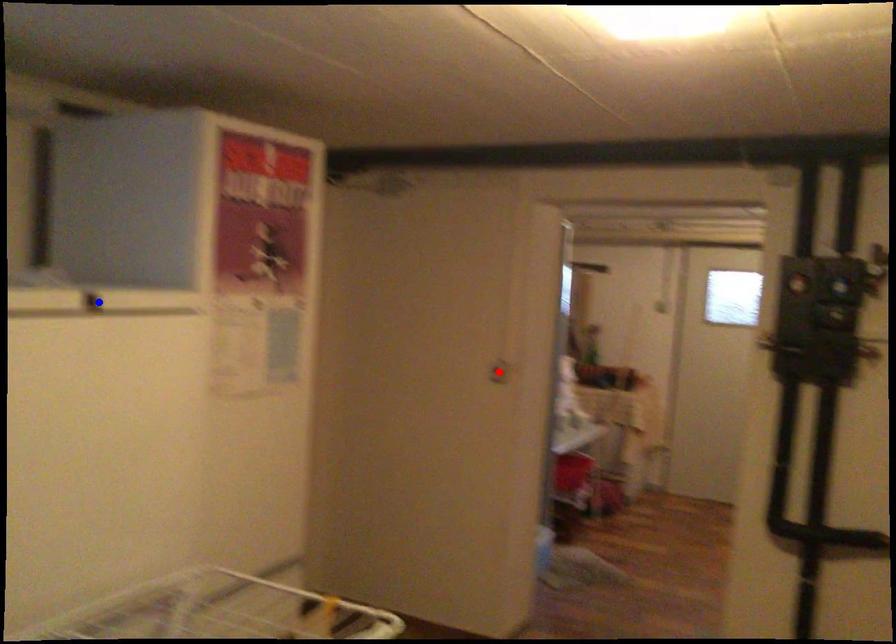
Question: Two points are marked on the image. Which point is closer to the camera?

Choices:
 (A) Blue point is closer.
 (B) Red point is closer.

Answer: (A)